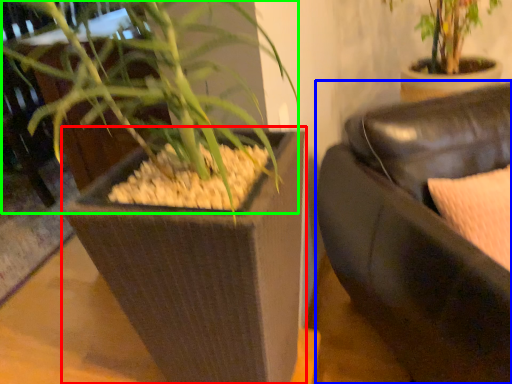
Question: Based on their relative distances, which object is farther from flowerpot (highlighted by a red box)? Choose from studio couch (highlighted by a blue box) and orchid (highlighted by a green box).

Choices:
 (A) studio couch
 (B) orchid

Answer: (A)